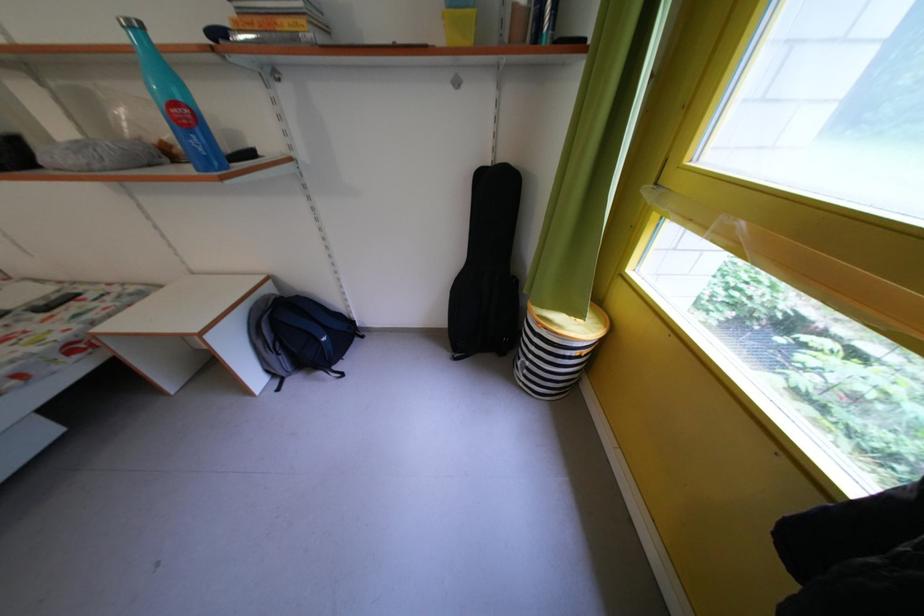
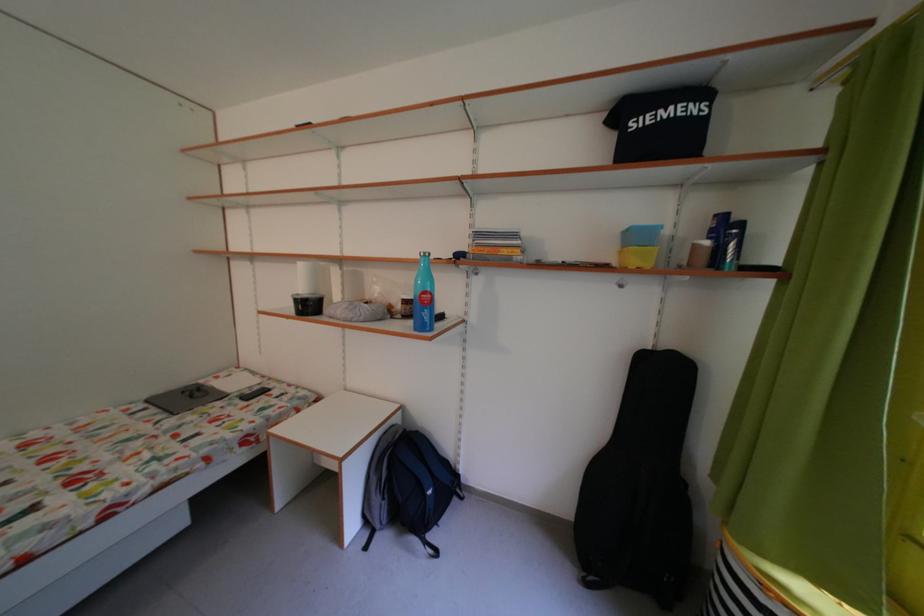
The first image is from the beginning of the video and the second image is from the end. How did the camera likely rotate when shooting the video?

The camera's rotation is toward left-up.